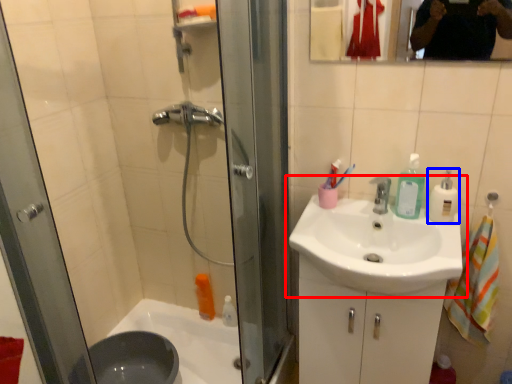
Question: Which of the following is the closest to the observer, sink (highlighted by a red box) or cleaning product (highlighted by a blue box)?

Choices:
 (A) sink
 (B) cleaning product

Answer: (A)